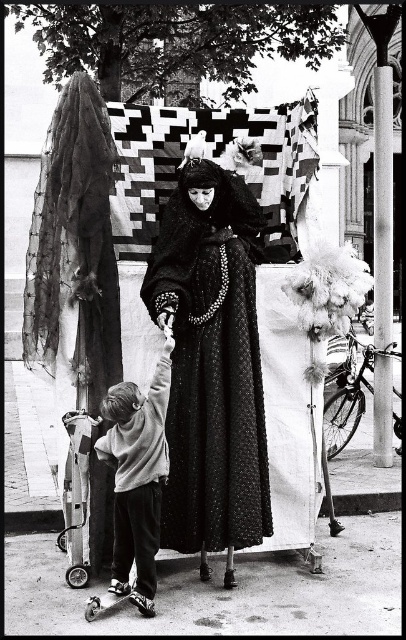
In the scene shown: You are standing at point (x=127, y=461) and want to move to the central figure on the stage. Is point (x=183, y=544) in your way?

Point (x=183, y=544) is behind point (x=127, y=461), so it is not in your way to reach the central figure on the stage.

Consider the image. You are an observer looking at this black and white photo. You see a black textured dress at center and a light gray sweater at lower left. Which object is positioned more to the right side of the image?

The black textured dress at center is positioned more to the right side of the image than the light gray sweater at lower left.

You are an observer standing in front of the platform. Which object is closer to you, the black textured dress at center or the light gray sweater at lower left?

The black textured dress at center is positioned over the light gray sweater at lower left, meaning it is closer to you since it is in front.